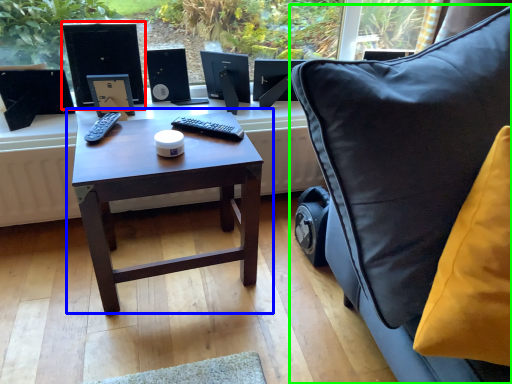
Question: Estimate the real-world distances between objects in this image. Which object is closer to desktop computer (highlighted by a red box), table (highlighted by a blue box) or chair (highlighted by a green box)?

Choices:
 (A) table
 (B) chair

Answer: (A)